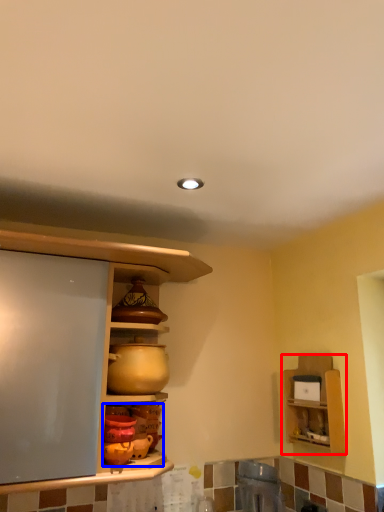
Question: Which of the following is the closest to the observer, shelf (highlighted by a red box) or pottery (highlighted by a blue box)?

Choices:
 (A) shelf
 (B) pottery

Answer: (B)